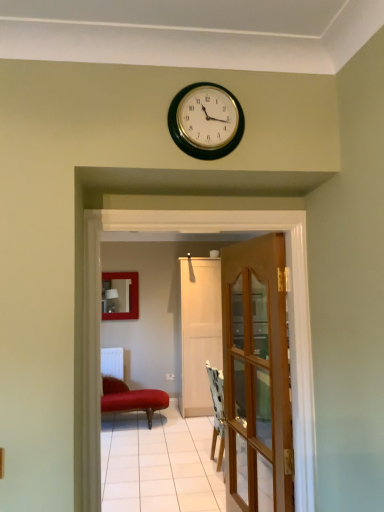
Question: Do you think velvet red studio couch at center is within metallic gold clock at upper center, or outside of it?

Choices:
 (A) inside
 (B) outside

Answer: (B)

Question: Visually, is velvet red studio couch at center positioned to the left or to the right of metallic gold clock at upper center?

Choices:
 (A) right
 (B) left

Answer: (B)

Question: Which object is the closest to the patterned fabric chair at center?

Choices:
 (A) white matte door at center, placed as the 2th door when sorted from front to back
 (B) velvet red studio couch at center
 (C) wooden glass door at center, the 2th door in the back-to-front sequence
 (D) metallic gold clock at upper center
 (E) white glossy door at center

Answer: (B)

Question: Which of these objects is positioned closest to the patterned fabric chair at center?

Choices:
 (A) white matte door at center, placed as the 2th door when sorted from front to back
 (B) smooth leather ottoman at center
 (C) velvet red studio couch at center
 (D) white glossy door at center
 (E) metallic gold clock at upper center

Answer: (B)